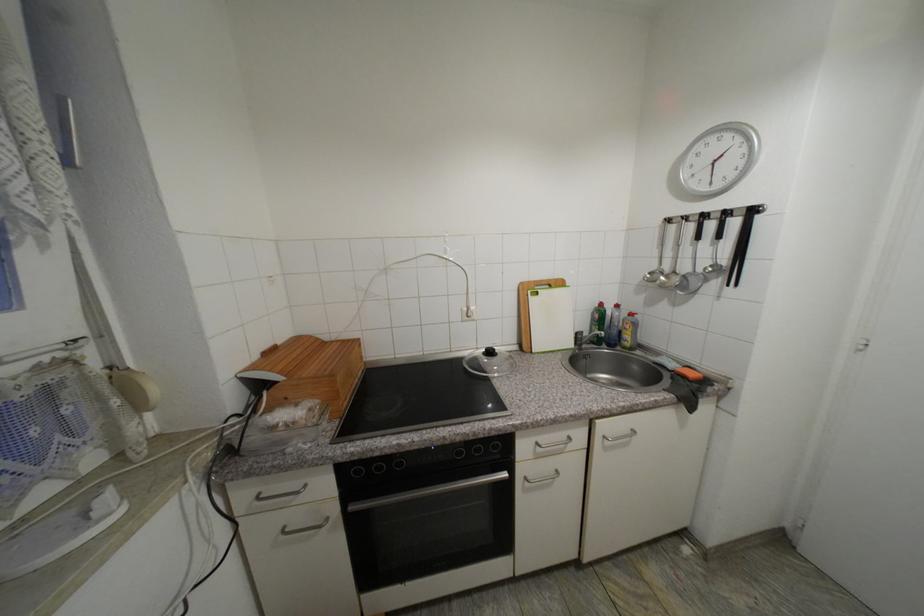
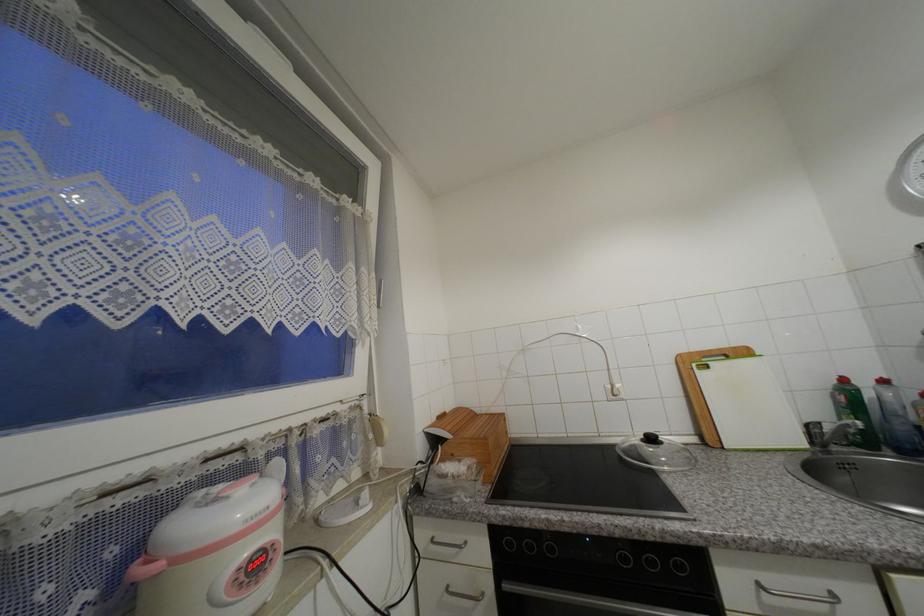
In the second image, find the point that corresponds to point 261,358 in the first image.

(440, 419)